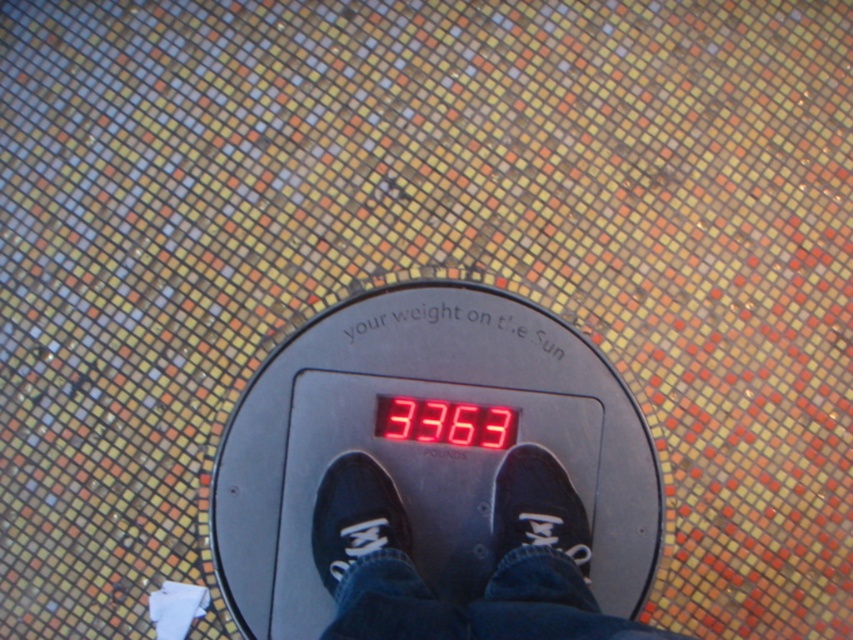
Between point (264, 404) and point (320, 506), which one is positioned in front?

Point (320, 506)

In the scene shown: Is black plastic scale at center taller than black suede shoe at center?

Yes.

Is point (358, 326) behind point (381, 492)?

Yes, point (358, 326) is farther from viewer.

Locate an element on the screen. The image size is (853, 640). black plastic scale at center is located at coordinates (426, 445).

Can you confirm if black plastic scale at center is positioned above black canvas shoe at center?

Yes, black plastic scale at center is above black canvas shoe at center.

Can you confirm if black plastic scale at center is positioned to the left of black canvas shoe at center?

Correct, you'll find black plastic scale at center to the left of black canvas shoe at center.

At what (x,y) coordinates should I click in order to perform the action: click on black plastic scale at center. Please return your answer as a coordinate pair (x, y). Looking at the image, I should click on (426, 445).

Is black canvas shoes at center further to camera compared to black suede shoe at center?

That is False.

Describe the element at coordinates (492, 556) in the screenshot. I see `black canvas shoes at center` at that location.

At what (x,y) coordinates should I click in order to perform the action: click on black canvas shoes at center. Please return your answer as a coordinate pair (x, y). Looking at the image, I should click on (492, 556).